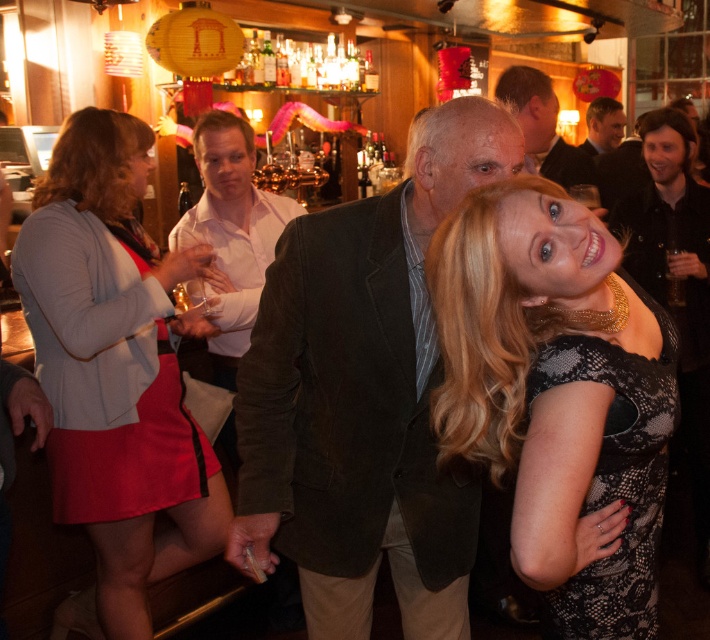
Does black lace dress at center appear over matte brown jacket at center?

No.

Who is lower down, black lace dress at center or matte brown jacket at center?

Positioned lower is black lace dress at center.

The image size is (710, 640). I want to click on black lace dress at center, so click(557, 396).

Locate an element on the screen. The height and width of the screenshot is (640, 710). black lace dress at center is located at coordinates (557, 396).

Is matte brown jacket at center bigger than dark brown leather jacket at upper center?

No.

I want to click on matte brown jacket at center, so click(231, 232).

You are a GUI agent. You are given a task and a screenshot of the screen. Output one action in this format:
    pyautogui.click(x=<x>, y=<y>)
    Task: Click on the matte brown jacket at center
    This screenshot has height=640, width=710.
    Given the screenshot: What is the action you would take?
    pyautogui.click(x=231, y=232)

Between point (290, 401) and point (518, 81), which one is positioned behind?

Positioned behind is point (518, 81).

Describe the element at coordinates (364, 396) in the screenshot. I see `dark brown corduroy blazer at center` at that location.

Is point (349, 381) farther from viewer compared to point (562, 164)?

No.

Where is `dark brown corduroy blazer at center`? dark brown corduroy blazer at center is located at coordinates (364, 396).